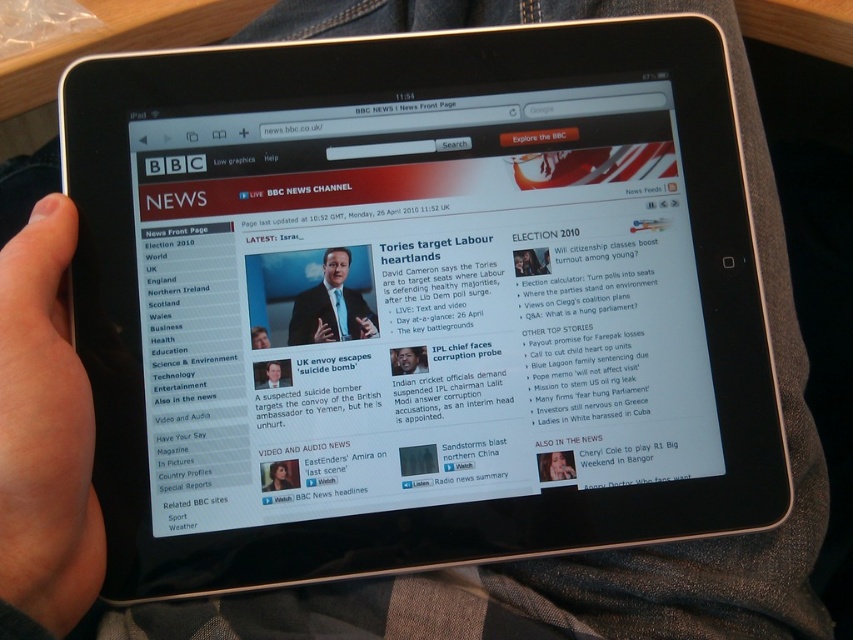
Is skinsmoothhand at left positioned before matte black suit at center?

Yes, skinsmoothhand at left is closer to the viewer.

Is skinsmoothhand at left taller than matte black suit at center?

Indeed, skinsmoothhand at left has a greater height compared to matte black suit at center.

Which is behind, point (45, 353) or point (341, 250)?

Positioned behind is point (341, 250).

This screenshot has height=640, width=853. I want to click on skinsmoothhand at left, so click(45, 432).

Does skinsmoothhand at left appear on the right side of smooth skin face at lower left?

No, skinsmoothhand at left is not to the right of smooth skin face at lower left.

Locate an element on the screen. This screenshot has width=853, height=640. skinsmoothhand at left is located at coordinates [x=45, y=432].

Is smooth skin face at lower center further to camera compared to smooth skin face at lower left?

Yes, smooth skin face at lower center is further from the viewer.

Can you confirm if smooth skin face at lower center is thinner than smooth skin face at lower left?

No, smooth skin face at lower center is not thinner than smooth skin face at lower left.

Between point (538, 461) and point (263, 470), which one is positioned in front?

Point (263, 470) is more forward.

At what (x,y) coordinates should I click in order to perform the action: click on smooth skin face at lower center. Please return your answer as a coordinate pair (x, y). Looking at the image, I should click on (555, 465).